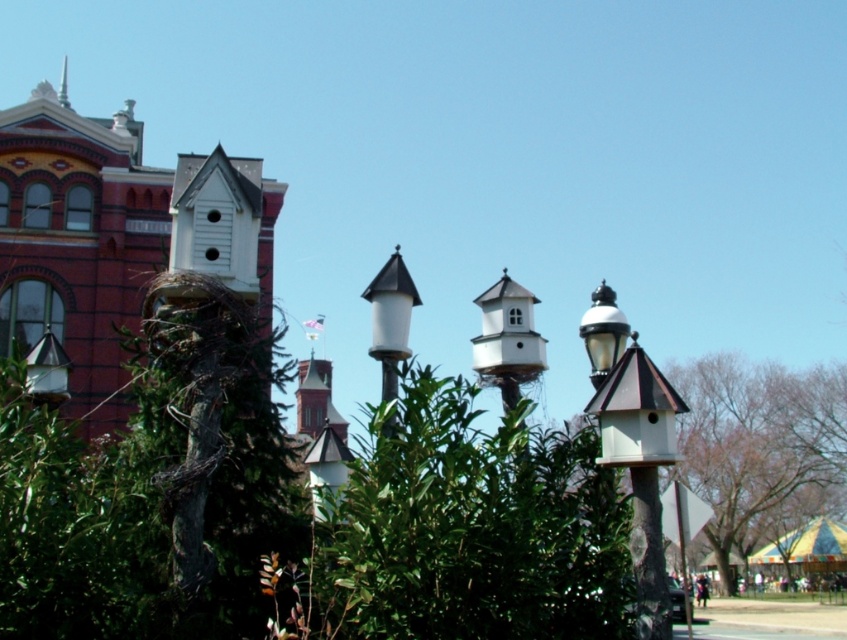
You are standing in front of the historic building and notice two points marked on the image. Which point, point (513, 611) or point (402, 268), is nearer to your current position?

Point (513, 611) is closer to the camera than point (402, 268), so it is nearer to your current position.

You are standing in front of the birdhouses on the lampposts. You notice two points marked in the image. Which point, point (360, 624) or point (248, 172), is closer to you?

Point (360, 624) is closer to the viewer than point (248, 172).

Looking at this image, you are a landscape architect designing a garden path that must pass between the green leafy bush at center and the white wood birdhouse at left. The path needs to be at least 1 meter wide. Can the space between them accommodate this width?

The green leafy bush at center has a width less than the white wood birdhouse at left. However, the description only provides a comparison between their widths, not the actual distance between them. Without knowing the exact spacing between the two objects, it is impossible to determine if the path can be 1 meter wide.